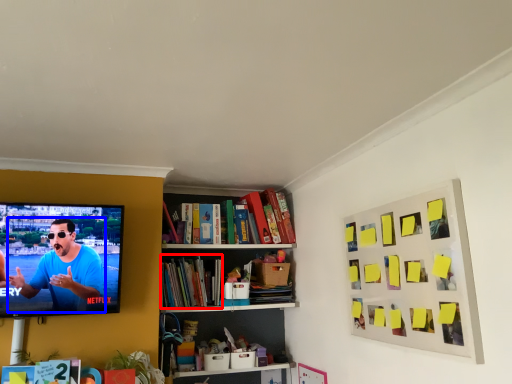
Question: Among these objects, which one is nearest to the camera, book (highlighted by a red box) or person (highlighted by a blue box)?

Choices:
 (A) book
 (B) person

Answer: (B)